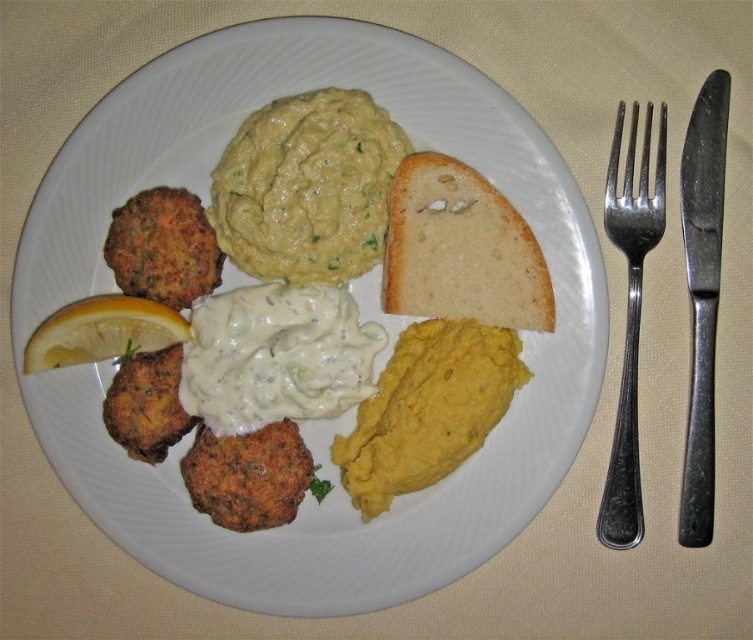
You are a food critic analyzing the plate layout. The plate has a white, textured surface. You need to determine the position of the green creamy hummus at center relative to the fried items at bottom left. Based on the coordinates given, is the hummus above or below the fried items?

The green creamy hummus at center is located at point (306, 188). Since the fried items are at the bottom left, which would have lower y coordinates, the hummus at 0.409 in the y coordinate is higher up, so it is above the fried items.

You are a food critic who needs to describe the size comparison between the green creamy hummus at center and the yellow matte lemon at left. Which one is larger?

The green creamy hummus at center is bigger than the yellow matte lemon at left.

You are a food critic analyzing the presentation of this dish. The white matte bread at upper center and the silver metallic fork at upper right are both on the plate. Which object is wider?

The white matte bread at upper center is wider than the silver metallic fork at upper right according to the description.